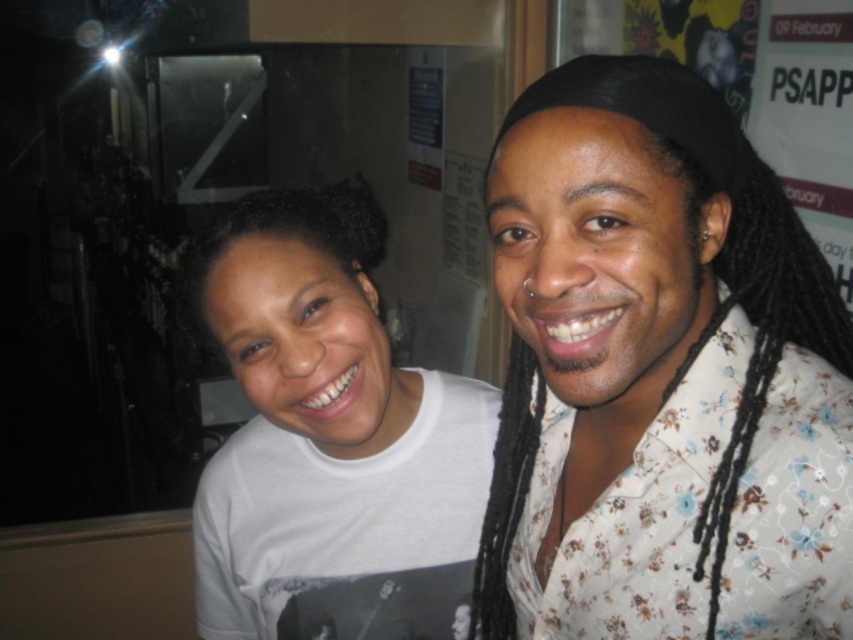
You are a photographer setting up for a portrait. You need to ensure that the floral print shirt at right and the black curly hair at upper left are both visible in the frame. Given their widths, which object should you adjust the camera angle to prioritize to ensure both fit comfortably?

The floral print shirt at right is wider than the black curly hair at upper left. To ensure both fit comfortably in the frame, prioritize adjusting the camera angle to accommodate the wider floral print shirt at right first, then position the black curly hair at upper left accordingly.